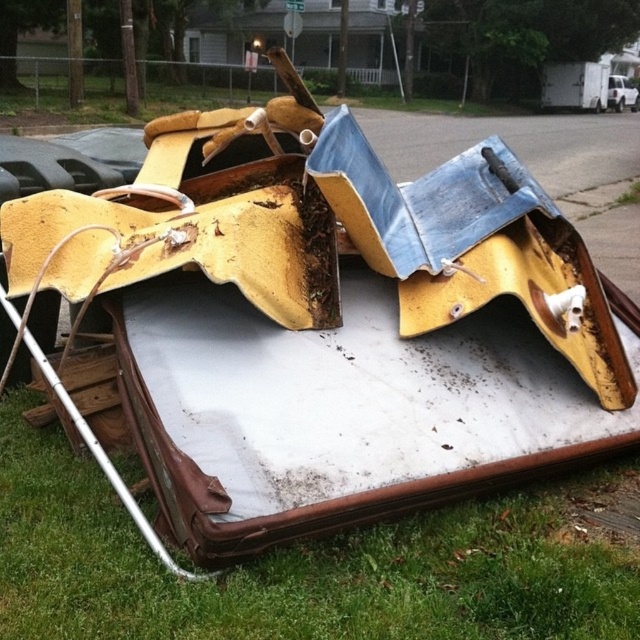
Question: Is green grass at lower left positioned at the back of white matte truck at upper right?

Choices:
 (A) yes
 (B) no

Answer: (B)

Question: Among these objects, which one is farthest from the camera?

Choices:
 (A) white matte truck at upper right
 (B) green grass at lower left

Answer: (A)

Question: Is green grass at lower left above white matte truck at upper right?

Choices:
 (A) yes
 (B) no

Answer: (B)

Question: Is green grass at lower left to the right of white matte truck at upper right from the viewer's perspective?

Choices:
 (A) no
 (B) yes

Answer: (A)